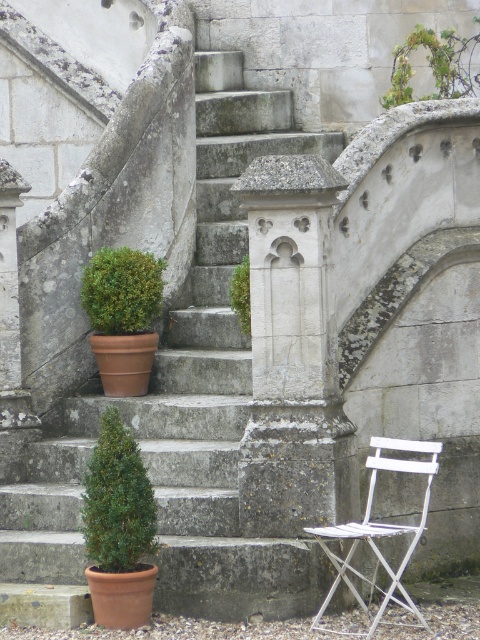
Question: Which of the following is the farthest from the observer?

Choices:
 (A) (105, 326)
 (B) (406, 72)
 (C) (134, 458)

Answer: (B)

Question: Does smooth stone stairs at center come behind green leafy plant at upper center?

Choices:
 (A) yes
 (B) no

Answer: (B)

Question: From the image, what is the correct spatial relationship of smooth stone stairs at center in relation to white painted wood chair at lower right?

Choices:
 (A) right
 (B) left

Answer: (B)

Question: Which of the following is the farthest from the observer?

Choices:
 (A) (131, 540)
 (B) (444, 44)
 (C) (249, 268)
 (D) (394, 468)

Answer: (B)

Question: Which object is the farthest from the smooth stone stairs at center?

Choices:
 (A) white painted wood chair at lower right
 (B) green mossy stone column at center

Answer: (A)

Question: Can you confirm if green matte hedge at lower left is thinner than green matte hedge at upper center?

Choices:
 (A) no
 (B) yes

Answer: (B)